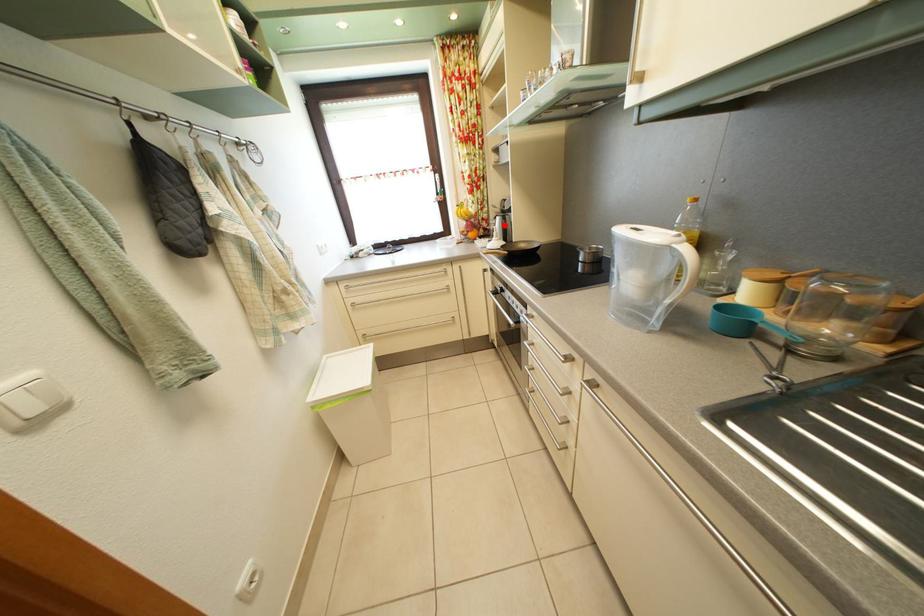
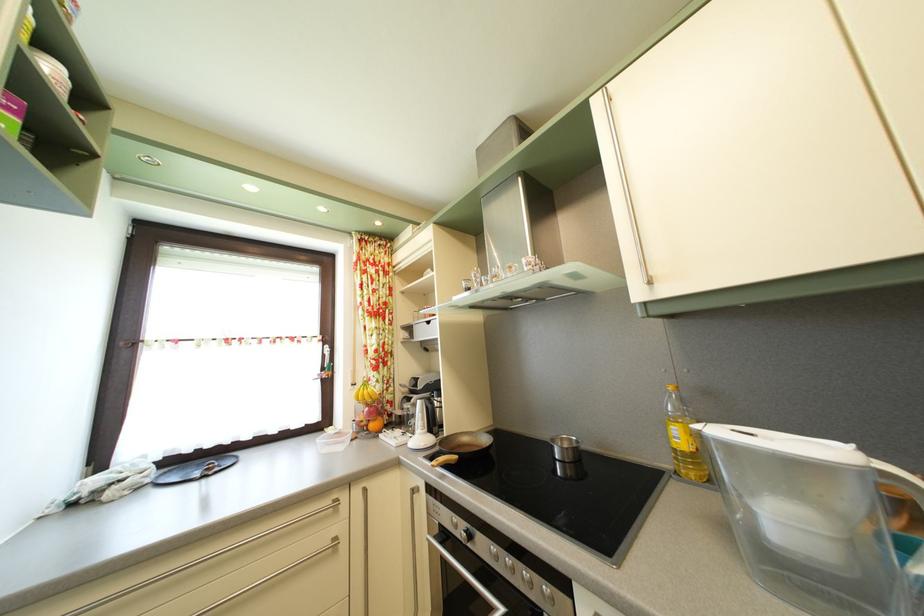
Question: I am providing you with two images of the same scene from different viewpoints. Image1 has a red point marked. In image2, the corresponding 3D location appears at what relative position? Reply with the corresponding letter.

Choices:
 (A) Closer
 (B) Farther

Answer: (B)